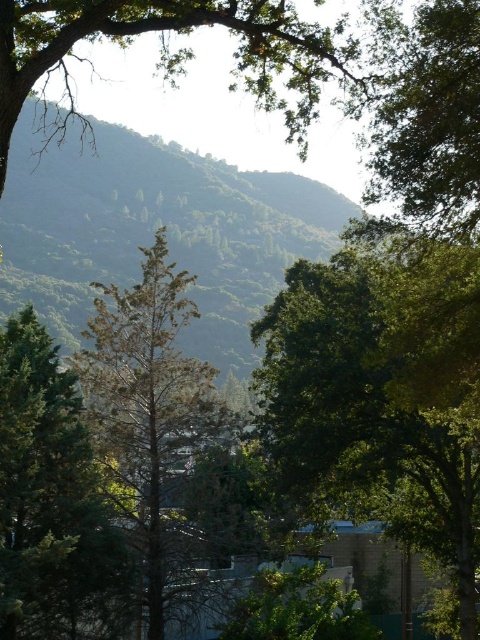
Question: Which of the following is the closest to the observer?

Choices:
 (A) (60, 205)
 (B) (406, 508)
 (C) (152, 522)
 (D) (371, 170)

Answer: (D)

Question: Based on their relative distances, which object is nearer to the green leafy tree at upper right?

Choices:
 (A) green needle-like tree at center
 (B) green leafy tree at center

Answer: (B)

Question: Among these points, which one is nearest to the camera?

Choices:
 (A) (419, 8)
 (B) (447, 289)
 (C) (156, 422)
 (D) (21, 147)

Answer: (A)

Question: Is green needle-like tree at center smaller than green leafy tree at upper right?

Choices:
 (A) no
 (B) yes

Answer: (A)

Question: Can you confirm if green leafy tree at center is wider than green leafy mountain at center?

Choices:
 (A) yes
 (B) no

Answer: (B)

Question: Is green leafy mountain at center wider than green leafy tree at upper right?

Choices:
 (A) no
 (B) yes

Answer: (B)